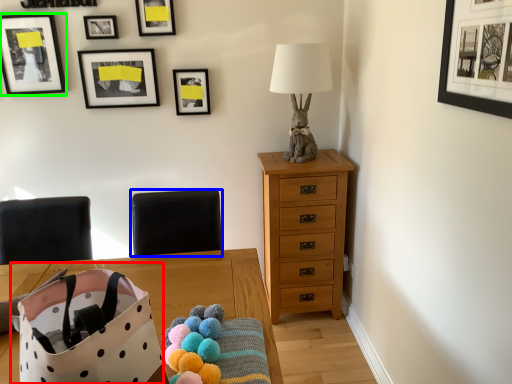
Question: Estimate the real-world distances between objects in this image. Which object is farther from gift bag (highlighted by a red box), armchair (highlighted by a blue box) or picture frame (highlighted by a green box)?

Choices:
 (A) armchair
 (B) picture frame

Answer: (B)